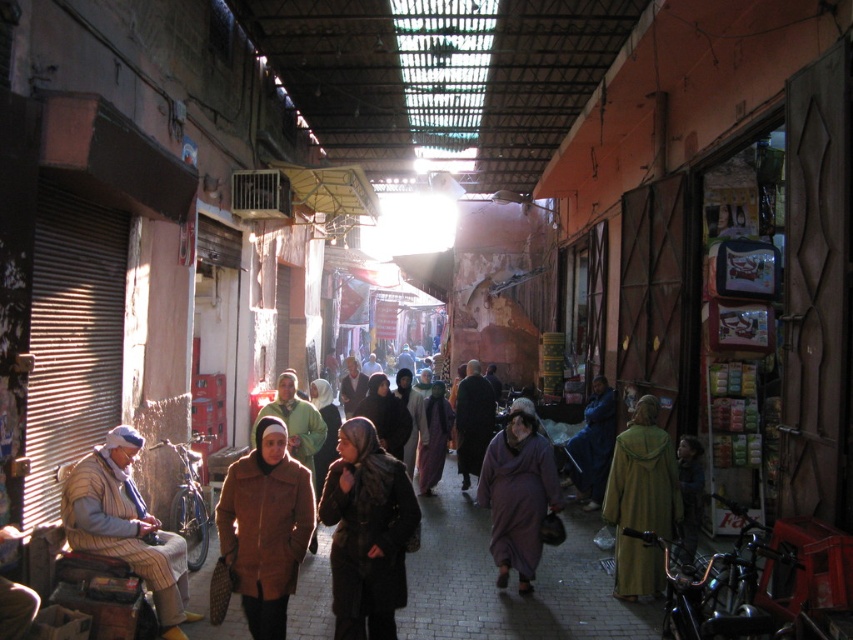
You are a vendor in the market and need to place both the dark brown fur coat at center and the dark purple fabric at center on a shelf that can only hold one item. Which item should you choose to fit on the shelf?

The dark purple fabric at center should be chosen because the dark brown fur coat at center is wider than the dark purple fabric at center, making the coat too large to fit on the shelf.